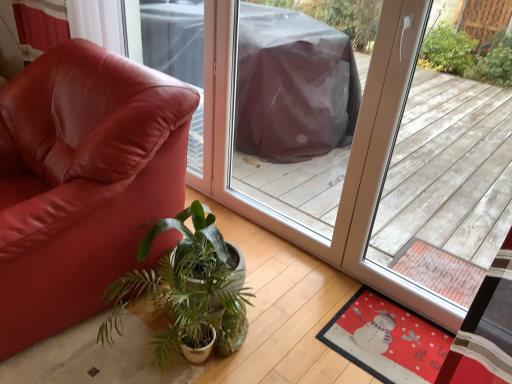
The height and width of the screenshot is (384, 512). Find the location of `vacant space in green leafy plant at center (from a real-world perspective)`. vacant space in green leafy plant at center (from a real-world perspective) is located at coordinates (166, 365).